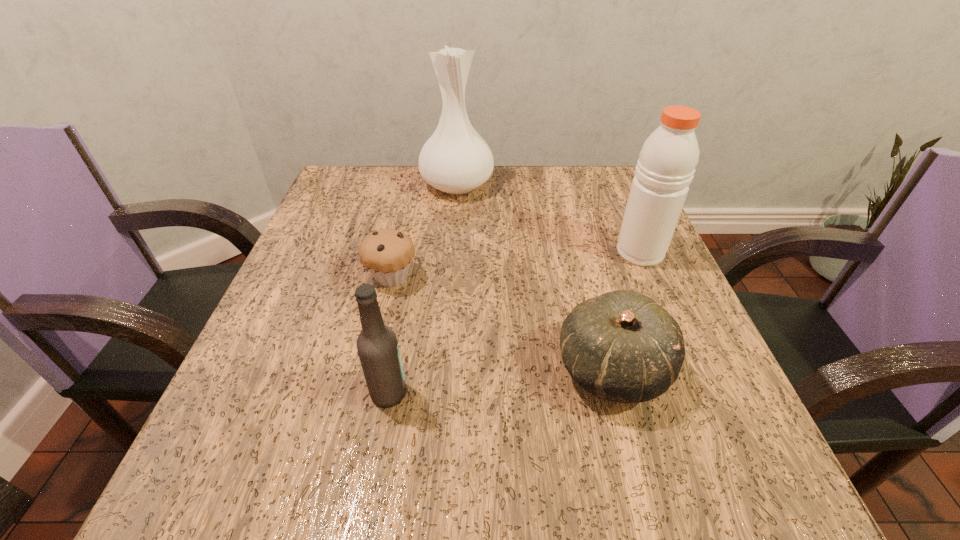
Image resolution: width=960 pixels, height=540 pixels. Identify the location of object at the far edge. (455, 160).

In order to click on object that is at the left edge in this screenshot , I will do `click(387, 253)`.

Where is `shaker at the right edge`? shaker at the right edge is located at coordinates (666, 165).

Image resolution: width=960 pixels, height=540 pixels. Find the location of `gourd situated at the right edge`. gourd situated at the right edge is located at coordinates (622, 346).

This screenshot has height=540, width=960. Find the location of `free space at the far edge of the desktop`. free space at the far edge of the desktop is located at coordinates (485, 214).

The image size is (960, 540). In order to click on free point at the near edge in this screenshot , I will do `click(366, 514)`.

The width and height of the screenshot is (960, 540). What are the coordinates of `vacant space at the left edge` in the screenshot? It's located at (327, 424).

This screenshot has width=960, height=540. Identify the location of vacant region at the far left corner of the desktop. (352, 178).

In the image, there is a desktop. Find the location of `vacant space at the far right corner`. vacant space at the far right corner is located at coordinates (619, 189).

In the image, there is a desktop. Where is `free region at the near right corner`? The width and height of the screenshot is (960, 540). free region at the near right corner is located at coordinates (718, 462).